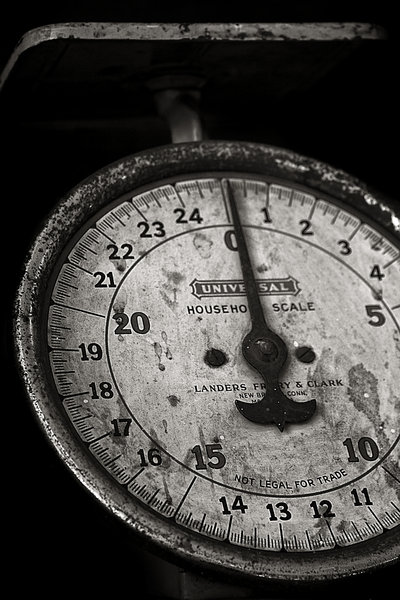
Where is `household scale`? The height and width of the screenshot is (600, 400). household scale is located at coordinates (225, 306), (285, 309).